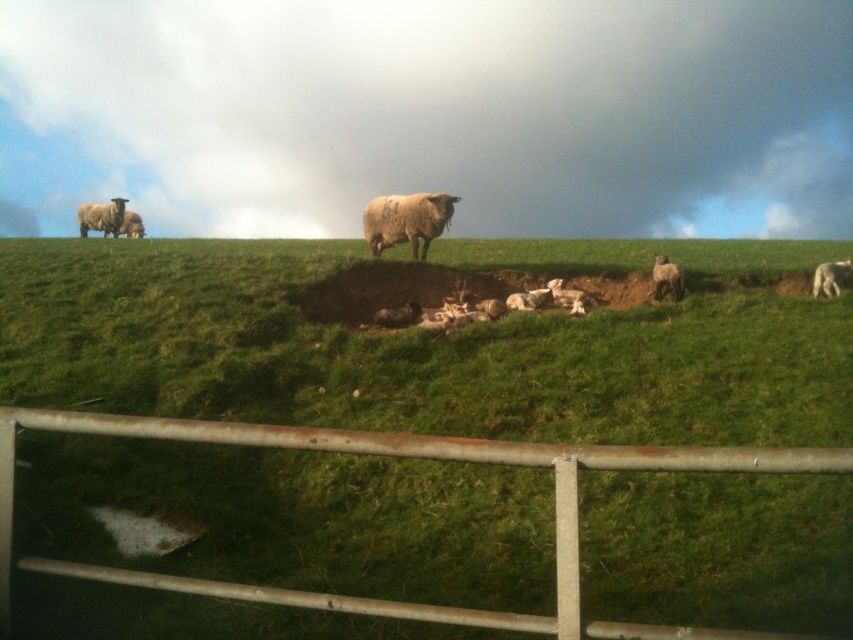
You are a photographer trying to capture a photo of the scene. You have two points marked on your camera screen at coordinates point (560,531) and point (103,232). If you want to focus on the point that is closer to the camera, which coordinate should you choose?

Point (560,531) is in front of point (103,232), so you should focus on point (560,531) to capture the closer one.

From the picture: You are a farmer checking the sheep in the field. You need to determine if the white woolly sheep at center can fit through a gate that is just wide enough for the white woolly sheep at left. Can it pass through?

The white woolly sheep at center might be wider than white woolly sheep at left, so there is a possibility it cannot pass through the gate designed for the smaller sheep.

You are a farmer checking the pasture. You see a point marked at coordinates (830, 276) in the image. What animal is located at that point?

The point at coordinates (830, 276) indicates a white woolly sheep at center.